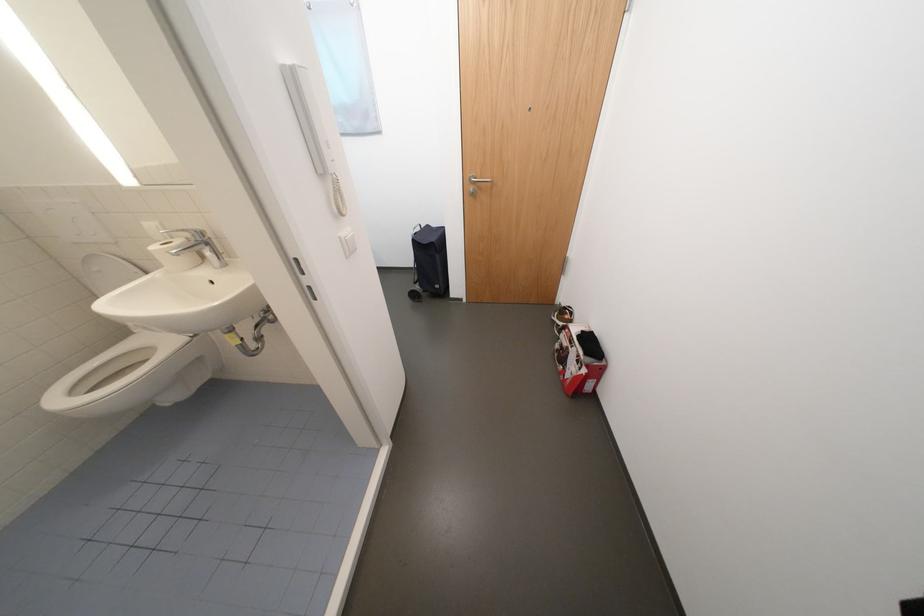
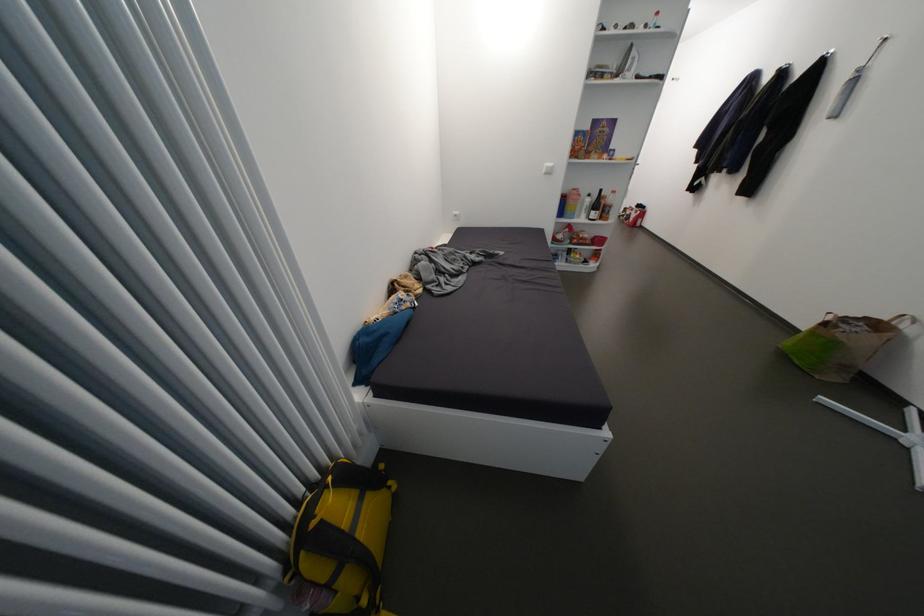
Where in the second image is the point corresponding to point (586, 362) from the first image?

(642, 214)